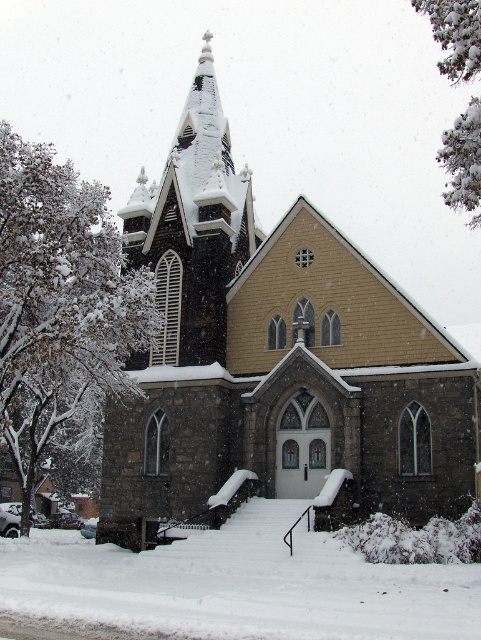
Between stone church at center and white fluffy snow at center, which one is positioned lower?

white fluffy snow at center

Which is in front, point (219, 381) or point (288, 563)?

Point (288, 563)

Locate an element on the screen. The image size is (481, 640). stone church at center is located at coordinates click(x=274, y=358).